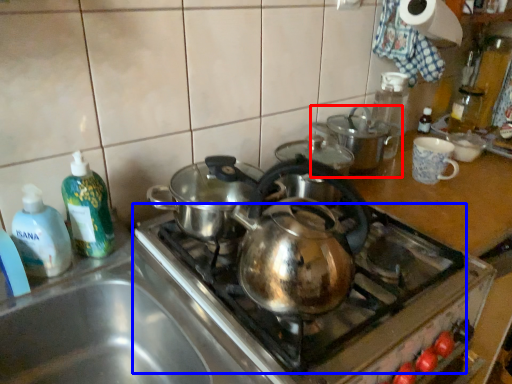
Question: Which object appears closest to the camera in this image, kitchen appliance (highlighted by a red box) or gas stove (highlighted by a blue box)?

Choices:
 (A) kitchen appliance
 (B) gas stove

Answer: (B)